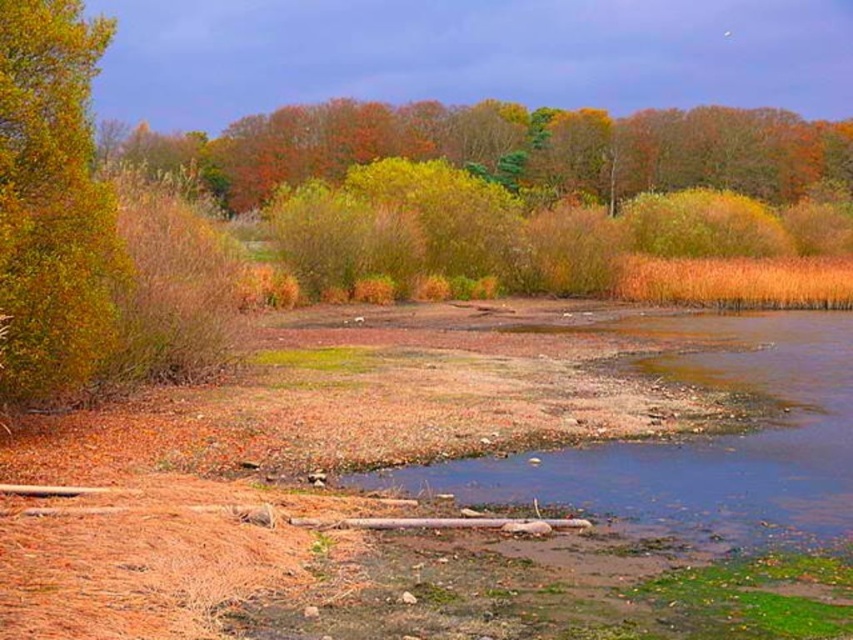
Question: Is autumn leaves at upper center behind golden textured bush at left?

Choices:
 (A) yes
 (B) no

Answer: (A)

Question: Can you confirm if autumn leaves at upper center is thinner than golden textured bush at left?

Choices:
 (A) no
 (B) yes

Answer: (A)

Question: Which point is farther to the camera?

Choices:
 (A) (427, 131)
 (B) (26, 356)

Answer: (A)

Question: Does autumn leaves at upper center appear under golden textured bush at left?

Choices:
 (A) yes
 (B) no

Answer: (B)